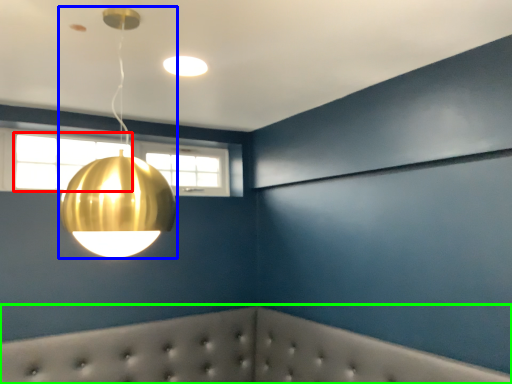
Question: Which object is positioned closest to window (highlighted by a red box)? Select from lamp (highlighted by a blue box) and furniture (highlighted by a green box).

Choices:
 (A) lamp
 (B) furniture

Answer: (B)